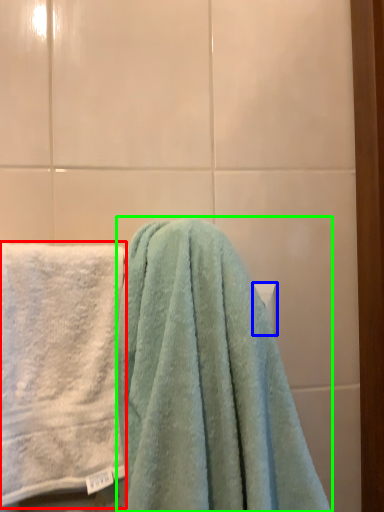
Question: Estimate the real-world distances between objects in this image. Which object is closer to towel (highlighted by a red box), towel bar (highlighted by a blue box) or towel (highlighted by a green box)?

Choices:
 (A) towel bar
 (B) towel

Answer: (B)